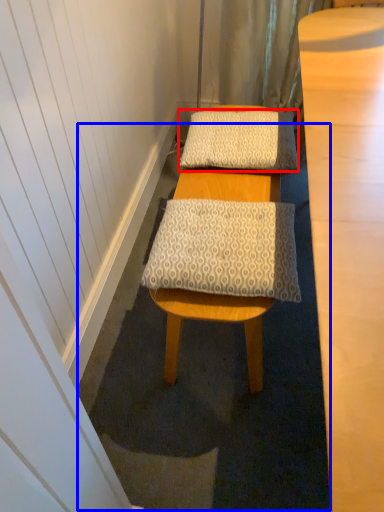
Question: Which point is closer to the camera, pillow (highlighted by a red box) or bath mat (highlighted by a blue box)?

Choices:
 (A) pillow
 (B) bath mat

Answer: (B)